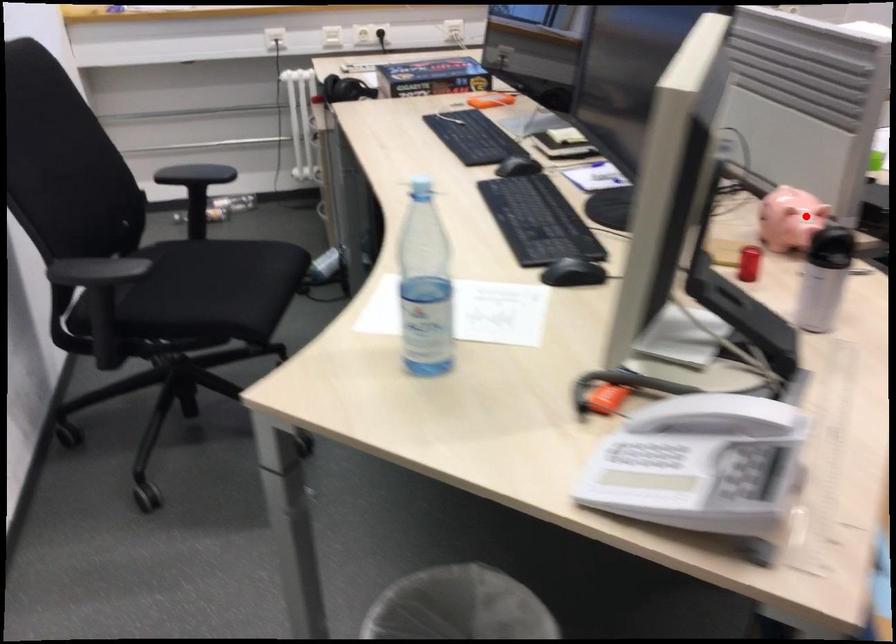
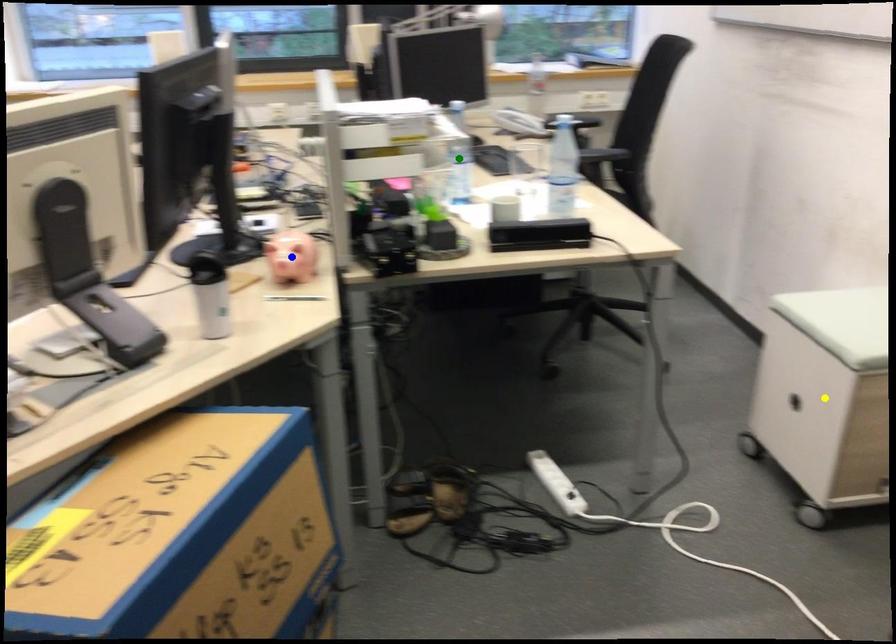
Question: I am providing you with two images of the same scene from different viewpoints. A red point is marked on the first image. You are given multiple points on the second image. In image 2, which mark is for the same physical point as the one in image 1?

Choices:
 (A) blue point
 (B) yellow point
 (C) green point

Answer: (A)